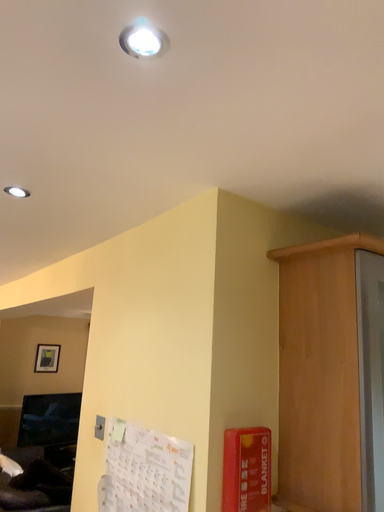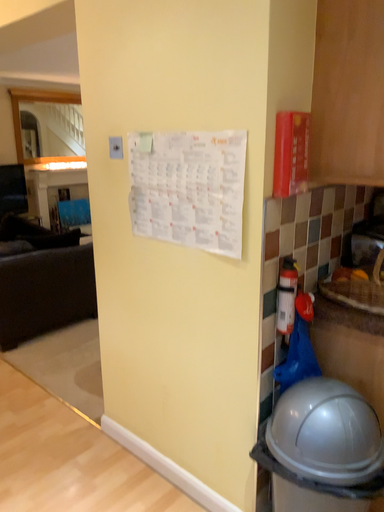
Question: Which way did the camera rotate in the video?

Choices:
 (A) rotated right
 (B) rotated left

Answer: (A)